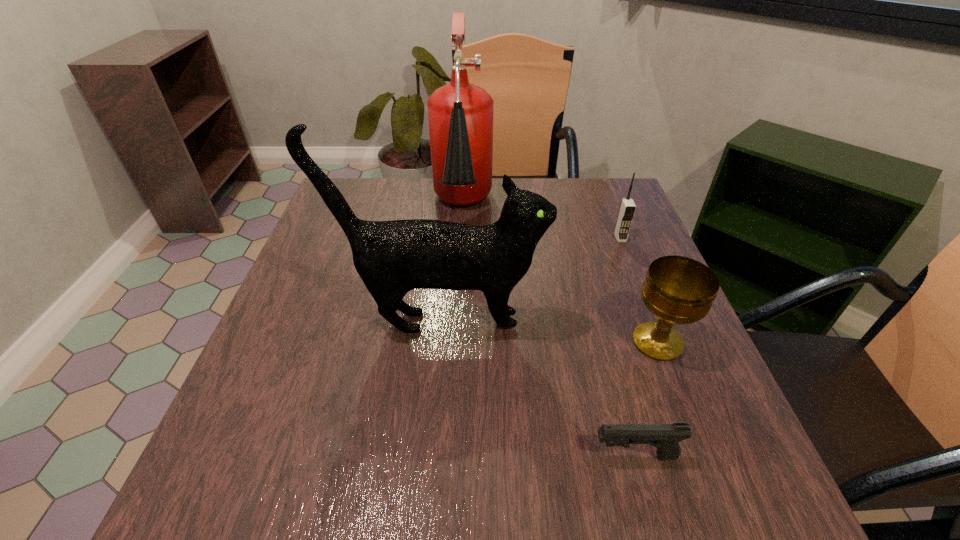
This screenshot has width=960, height=540. I want to click on fire extinguisher, so click(460, 115).

Identify the location of cat. This screenshot has width=960, height=540. (392, 258).

Identify the location of cellular telephone. The height and width of the screenshot is (540, 960). (627, 208).

Where is `chalice`? Image resolution: width=960 pixels, height=540 pixels. chalice is located at coordinates (678, 290).

This screenshot has height=540, width=960. What are the coordinates of `the nearest object` in the screenshot? It's located at (665, 437).

The image size is (960, 540). Identify the location of the shortest object. (665, 437).

I want to click on vacant area located 0.270m with the nozzle aimed from the fire extinguisher, so click(x=456, y=329).

This screenshot has height=540, width=960. I want to click on vacant position located on the face of the cat, so click(x=649, y=322).

At what (x,y) coordinates should I click in order to perform the action: click on vacant space located on the front-facing side of the cellular telephone. Please return your answer as a coordinate pair (x, y). Looking at the image, I should click on (640, 289).

You are a GUI agent. You are given a task and a screenshot of the screen. Output one action in this format:
    pyautogui.click(x=<x>, y=<y>)
    Task: Click on the vacant space located 0.090m on the front of the chalice
    This screenshot has width=960, height=540.
    Given the screenshot: What is the action you would take?
    point(684,411)